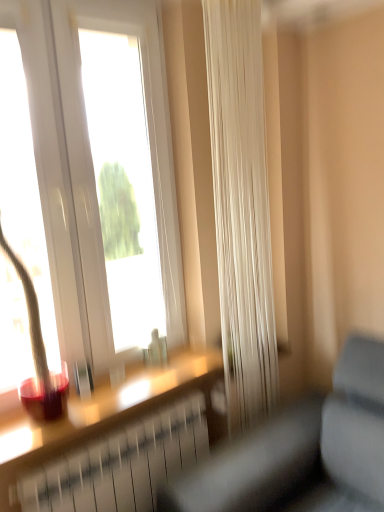
Question: Is white sheer curtain at center next to matte glass window sill at lower left and touching it?

Choices:
 (A) no
 (B) yes

Answer: (A)

Question: From the image's perspective, is white sheer curtain at center above matte glass window sill at lower left?

Choices:
 (A) no
 (B) yes

Answer: (B)

Question: Considering the relative sizes of white sheer curtain at center and matte glass window sill at lower left in the image provided, is white sheer curtain at center smaller than matte glass window sill at lower left?

Choices:
 (A) no
 (B) yes

Answer: (A)

Question: Could you tell me if white sheer curtain at center is facing matte glass window sill at lower left?

Choices:
 (A) yes
 (B) no

Answer: (B)

Question: Is matte glass window sill at lower left surrounded by white sheer curtain at center?

Choices:
 (A) yes
 (B) no

Answer: (B)

Question: Is point (329, 458) positioned closer to the camera than point (44, 454)?

Choices:
 (A) farther
 (B) closer

Answer: (A)

Question: Is gray fabric couch at lower right inside the boundaries of matte glass window sill at lower left, or outside?

Choices:
 (A) inside
 (B) outside

Answer: (B)

Question: From the image's perspective, is gray fabric couch at lower right positioned above or below matte glass window sill at lower left?

Choices:
 (A) above
 (B) below

Answer: (B)

Question: From a real-world perspective, relative to matte glass window sill at lower left, is gray fabric couch at lower right vertically above or below?

Choices:
 (A) above
 (B) below

Answer: (B)

Question: Looking at the image, does white sheer curtain at center seem bigger or smaller compared to gray fabric couch at lower right?

Choices:
 (A) big
 (B) small

Answer: (B)

Question: Does point (261, 296) appear closer or farther from the camera than point (231, 506)?

Choices:
 (A) closer
 (B) farther

Answer: (B)

Question: In the image, is white sheer curtain at center positioned in front of or behind gray fabric couch at lower right?

Choices:
 (A) front
 (B) behind

Answer: (B)

Question: From a real-world perspective, is white sheer curtain at center physically located above or below gray fabric couch at lower right?

Choices:
 (A) above
 (B) below

Answer: (A)

Question: From a real-world perspective, is matte glass window sill at lower left positioned above or below gray fabric couch at lower right?

Choices:
 (A) above
 (B) below

Answer: (A)

Question: In terms of width, does matte glass window sill at lower left look wider or thinner when compared to gray fabric couch at lower right?

Choices:
 (A) wide
 (B) thin

Answer: (B)